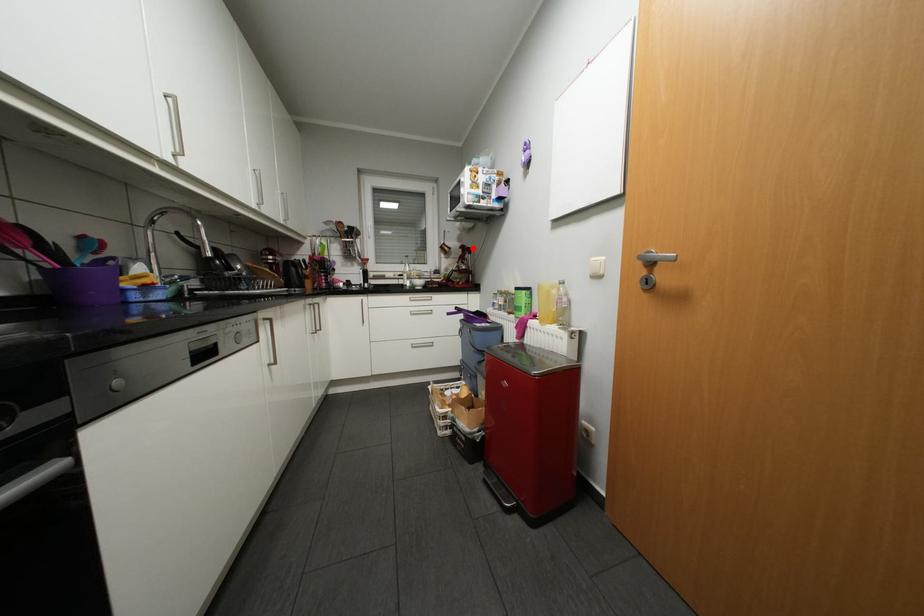
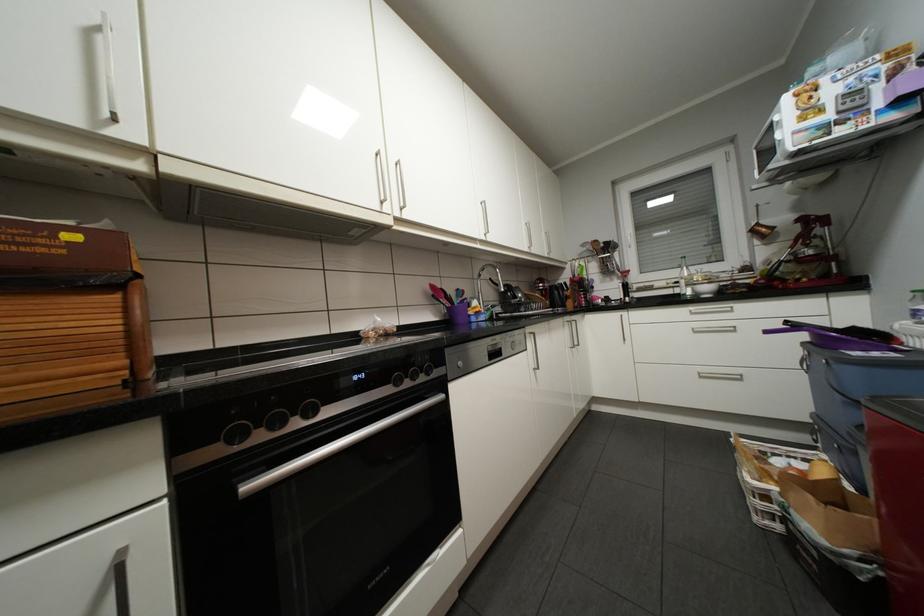
Find the pixel in the second image that matches the highlighted location in the first image.

(819, 220)